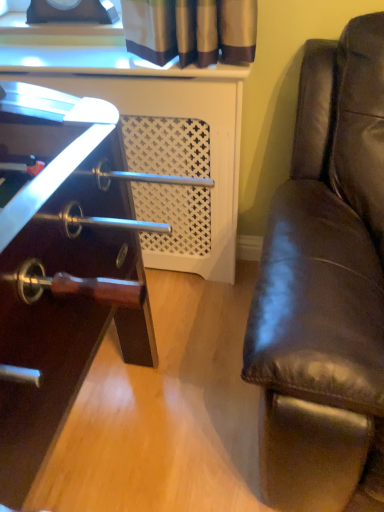
This screenshot has width=384, height=512. Describe the element at coordinates (64, 281) in the screenshot. I see `dark wood foosball table at left` at that location.

Where is `dark wood foosball table at left`? This screenshot has width=384, height=512. dark wood foosball table at left is located at coordinates (64, 281).

I want to click on dark wood foosball table at left, so click(x=64, y=281).